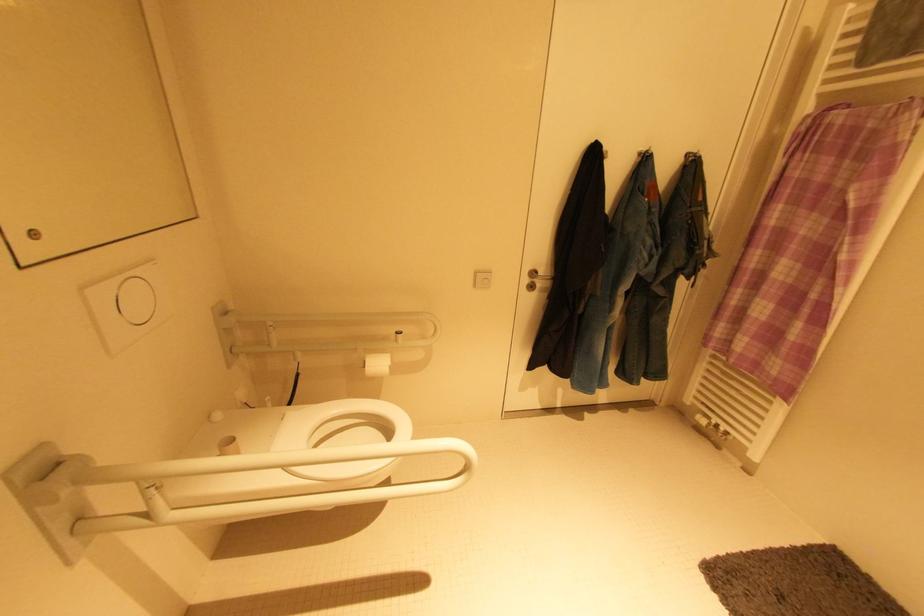
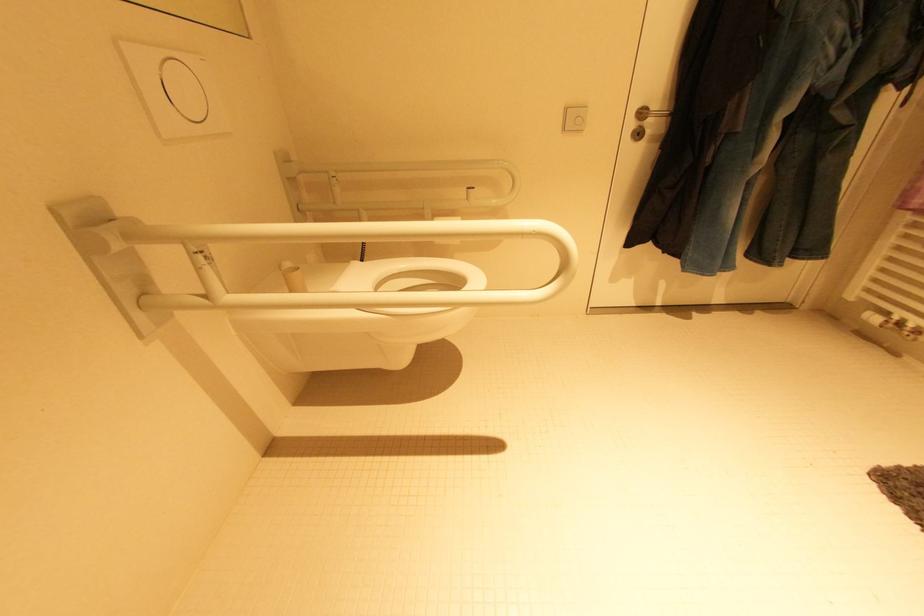
Question: Which direction would the cameraman need to move to produce the second image? Reply with the corresponding letter.

Choices:
 (A) Left
 (B) Right
 (C) Forward
 (D) Backward

Answer: (C)